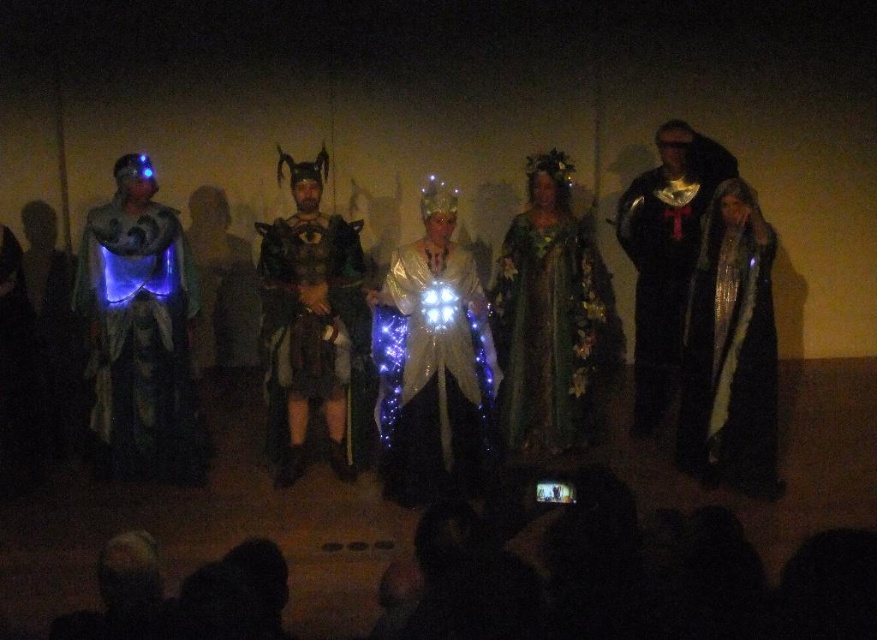
Is shiny silver robe at right smaller than green floral dress at center?

Yes, shiny silver robe at right is smaller than green floral dress at center.

Does point (703, 230) come closer to viewer compared to point (555, 252)?

Yes, it is.

Locate an element on the screen. The image size is (877, 640). shiny silver robe at right is located at coordinates (731, 349).

Does shiny silver robe at right appear on the right side of black velvet cape at center?

Yes, shiny silver robe at right is to the right of black velvet cape at center.

Between point (739, 372) and point (638, 177), which one is positioned behind?

The point (638, 177) is more distant.

Locate an element on the screen. The width and height of the screenshot is (877, 640). shiny silver robe at right is located at coordinates (731, 349).

Is luminous fabric cape at left shorter than shiny silver robe at right?

Correct, luminous fabric cape at left is not as tall as shiny silver robe at right.

Which is in front, point (175, 442) or point (772, 228)?

Point (772, 228) is in front.

Locate an element on the screen. luminous fabric cape at left is located at coordinates (139, 342).